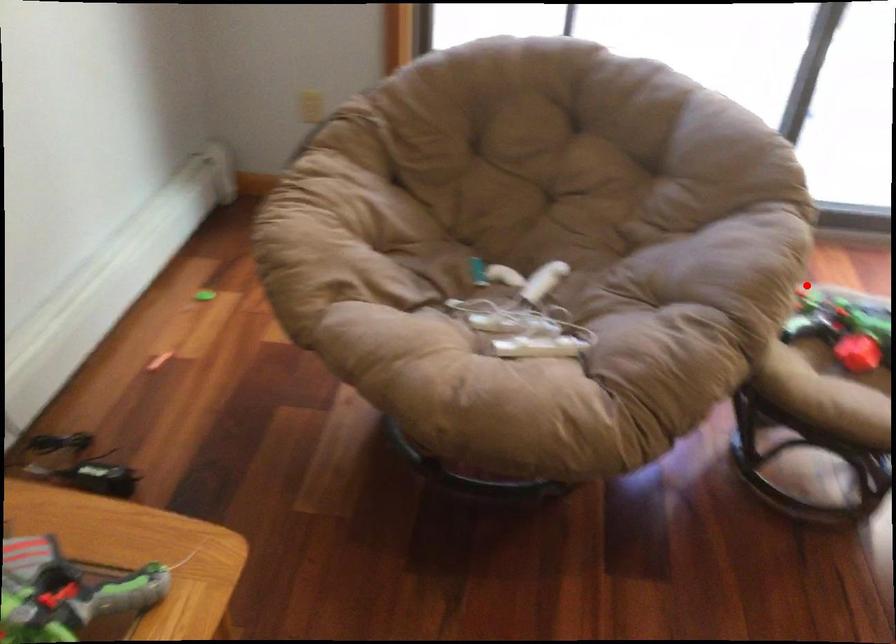
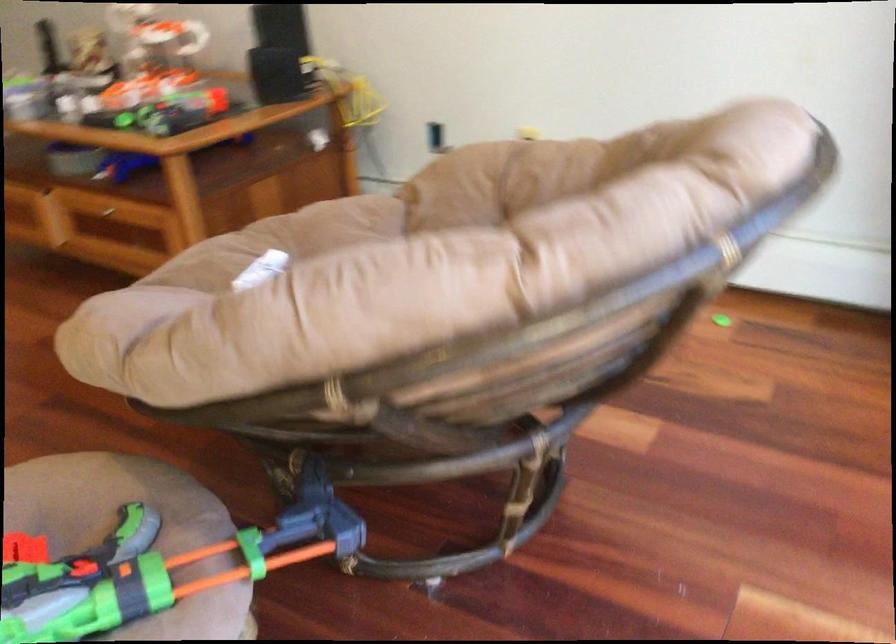
Where in the second image is the point corresponding to the highlighted location from the first image?

(159, 567)